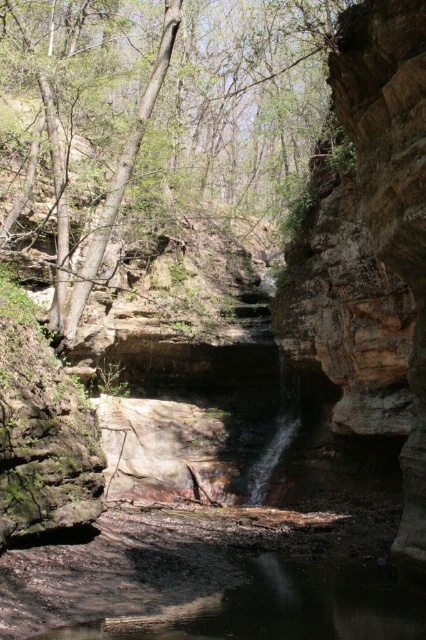
Can you confirm if brown rough tree at center is taller than brown rough rock at center?

Yes, brown rough tree at center is taller than brown rough rock at center.

Is point (324, 58) positioned before point (391, 163)?

No, (324, 58) is further to viewer.

The width and height of the screenshot is (426, 640). In order to click on brown rough tree at center in this screenshot , I will do `click(157, 115)`.

Does brown rough tree at center have a lesser height compared to clear water at center?

Incorrect, brown rough tree at center's height does not fall short of clear water at center's.

Between brown rough tree at center and clear water at center, which one appears on the right side from the viewer's perspective?

From the viewer's perspective, clear water at center appears more on the right side.

Is point (169, 22) more distant than point (414, 604)?

Yes, it is behind point (414, 604).

Locate an element on the screen. The height and width of the screenshot is (640, 426). brown rough tree at center is located at coordinates (157, 115).

Is point (334, 51) positioned behind point (170, 616)?

Yes, point (334, 51) is farther from viewer.

Measure the distance between point (336,48) and camera.

They are 96.69 feet apart.

In order to click on brown rough rock at center in this screenshot , I will do `click(370, 244)`.